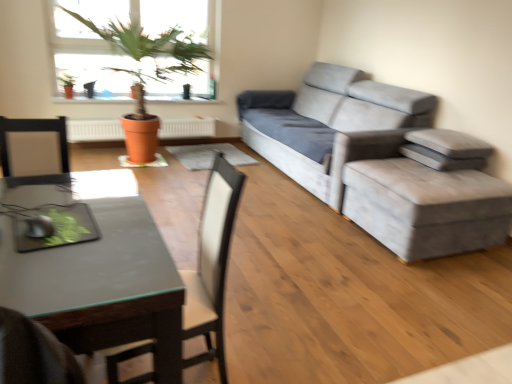
Question: From a real-world perspective, is terracotta clay pot at upper left positioned above or below black leather swivel chair at center?

Choices:
 (A) above
 (B) below

Answer: (A)

Question: Based on their sizes in the image, would you say terracotta clay pot at upper left is bigger or smaller than black leather swivel chair at center?

Choices:
 (A) big
 (B) small

Answer: (B)

Question: Estimate the real-world distances between objects in this image. Which object is closer to the terracotta clay pot at upper left?

Choices:
 (A) black leather swivel chair at center
 (B) gray fabric pillow at right, which ranks as the 2th pillow in bottom-to-top order
 (C) gray fabric pillow at right, marked as the 1th pillow in a bottom-to-top arrangement
 (D) velvet grey couch at right
 (E) matte terracotta pot at upper left, marked as the second houseplant in a right-to-left arrangement

Answer: (E)

Question: Estimate the real-world distances between objects in this image. Which object is closer to the black glass desk at lower left?

Choices:
 (A) velvet grey stool at right
 (B) black leather swivel chair at center
 (C) gray fabric pillow at right, marked as the 1th pillow in a bottom-to-top arrangement
 (D) terracotta clay pot at upper left
 (E) matte terracotta pot at upper left, positioned as the 2th houseplant in front-to-back order

Answer: (B)